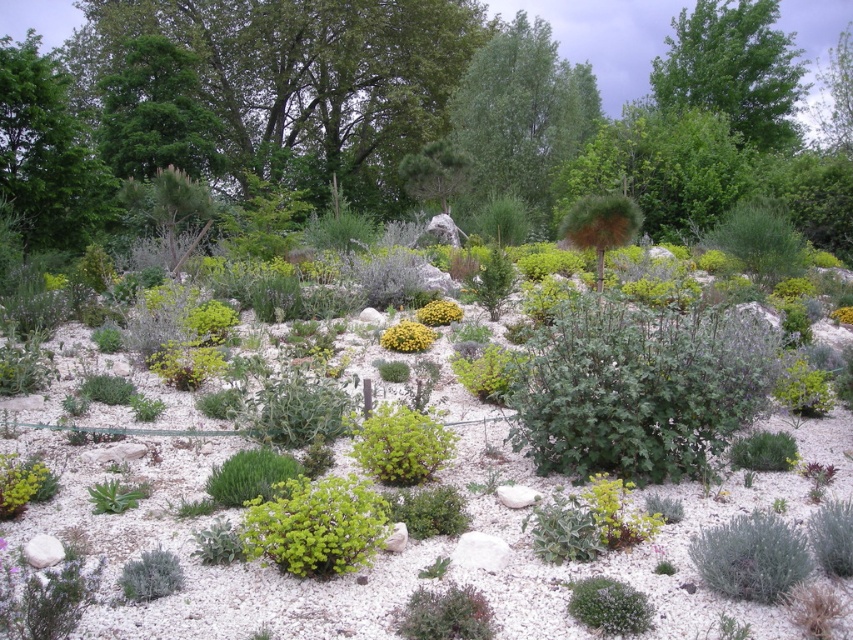
Question: Can you confirm if green leafy plant at lower left is smaller than yellow-green textured bush at center?

Choices:
 (A) no
 (B) yes

Answer: (B)

Question: Can you confirm if green leafy tree at upper center is positioned below yellow-green textured plant at center?

Choices:
 (A) yes
 (B) no

Answer: (B)

Question: Does green leafy tree at upper center have a smaller size compared to yellow-green textured plant at center?

Choices:
 (A) no
 (B) yes

Answer: (A)

Question: Which object appears closest to the camera in this image?

Choices:
 (A) green leafy plant at center
 (B) green leafy tree at upper center
 (C) yellow-green textured bush at center

Answer: (A)

Question: Which of the following is the farthest from the observer?

Choices:
 (A) (535, 154)
 (B) (611, 480)

Answer: (A)

Question: Which point is closer to the camera taking this photo?

Choices:
 (A) (296, 148)
 (B) (426, 337)

Answer: (B)